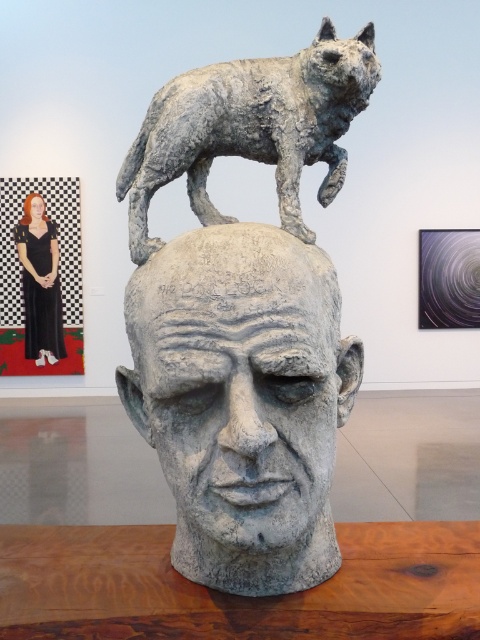
You are an art curator planning to move the gray stone head at center and the gray textured dog at upper center to a new exhibition space. The new space has a height restriction of 1.5 meters. Given their sizes, will both sculptures fit under this height limit?

The gray stone head at center is larger than the gray textured dog at upper center. However, without specific height measurements, it is impossible to determine if they meet the 1.5 meter height restriction. Additional information about their exact heights is required.

You are an art curator planning to hang a new painting above the black dress at upper left. Based on the current arrangement, where should the new painting be placed relative to the matte black portrait at upper left?

The black dress at upper left is below the matte black portrait at upper left, so the new painting should be placed above the matte black portrait at upper left to maintain the hierarchy.

You are standing in the art gallery and want to take a photo of the gray stone head at center. The gallery has a rule that you must stand exactly at point (244, 317) to take the photo. Is the gray stone head at center visible from that point?

The gray stone head at center is located at point (244, 317), so standing there would mean you are at the same location as the sculpture. You would not be able to see it from that point as you would be on top of it.